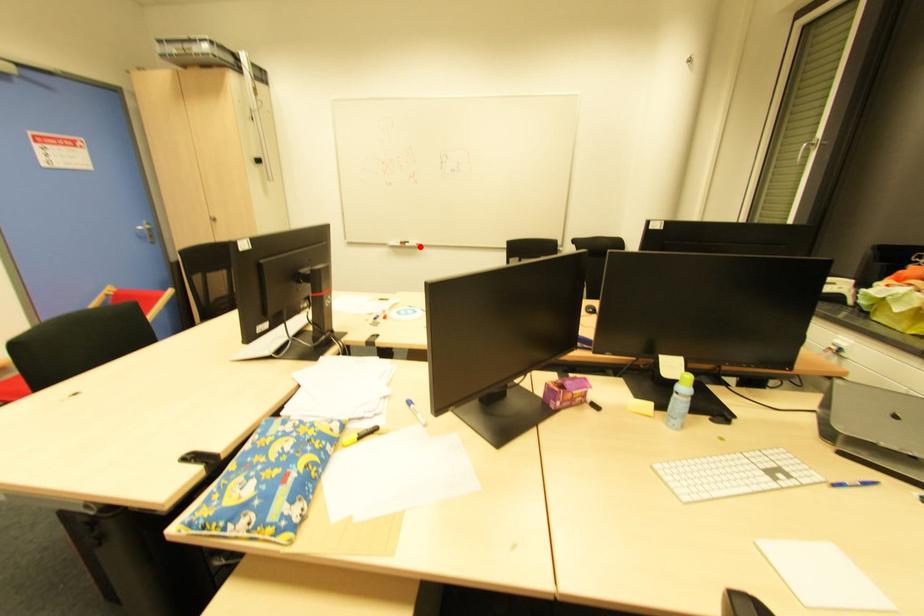
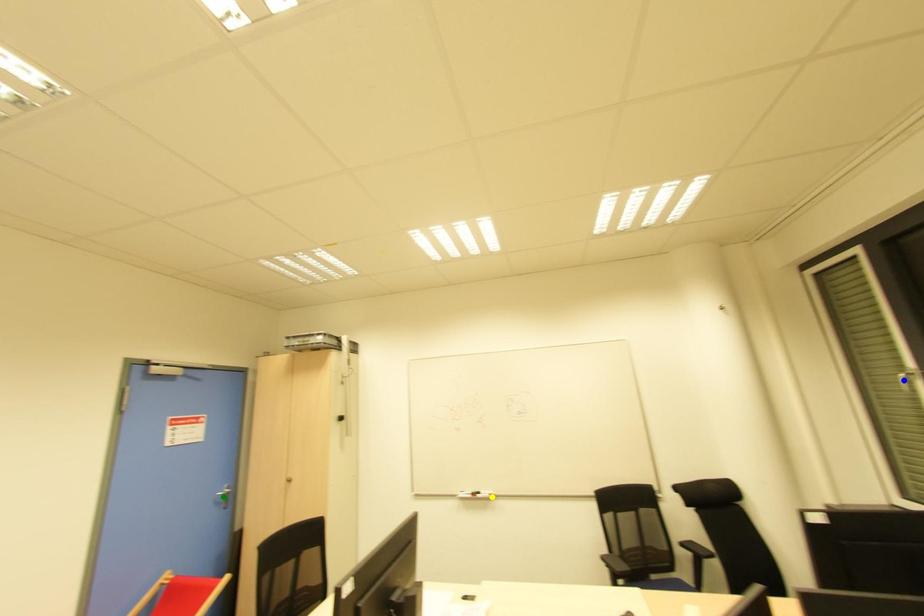
Question: I am providing you with two images of the same scene from different viewpoints. A red point is marked on the first image. You are given multiple points on the second image. Which spot in image 2 lines up with the point in image 1?

Choices:
 (A) yellow point
 (B) blue point
 (C) green point

Answer: (A)